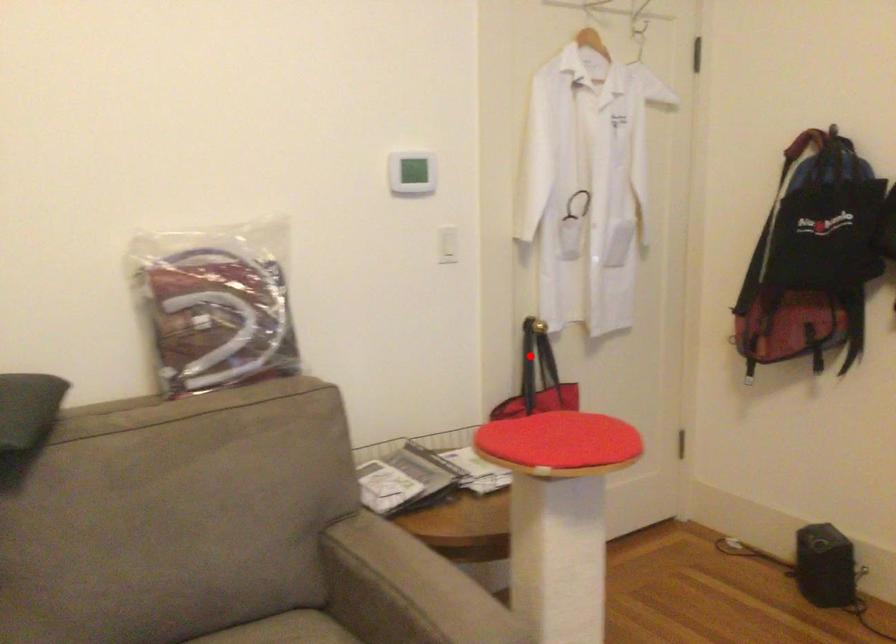
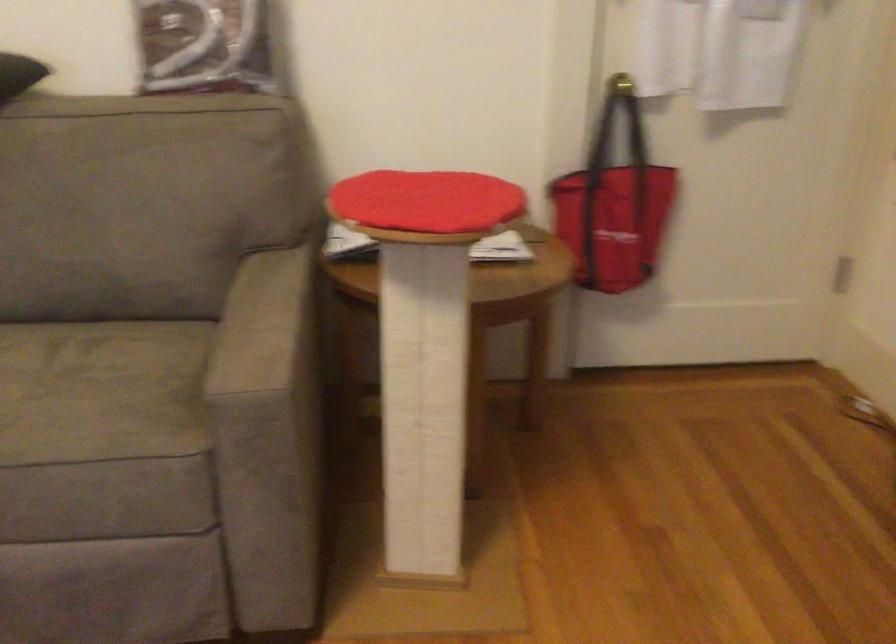
Question: I am providing you with two images of the same scene from different viewpoints. A red point is shown in image1. For the corresponding object point in image2, is it positioned nearer or farther from the camera?

Choices:
 (A) Nearer
 (B) Farther

Answer: (A)